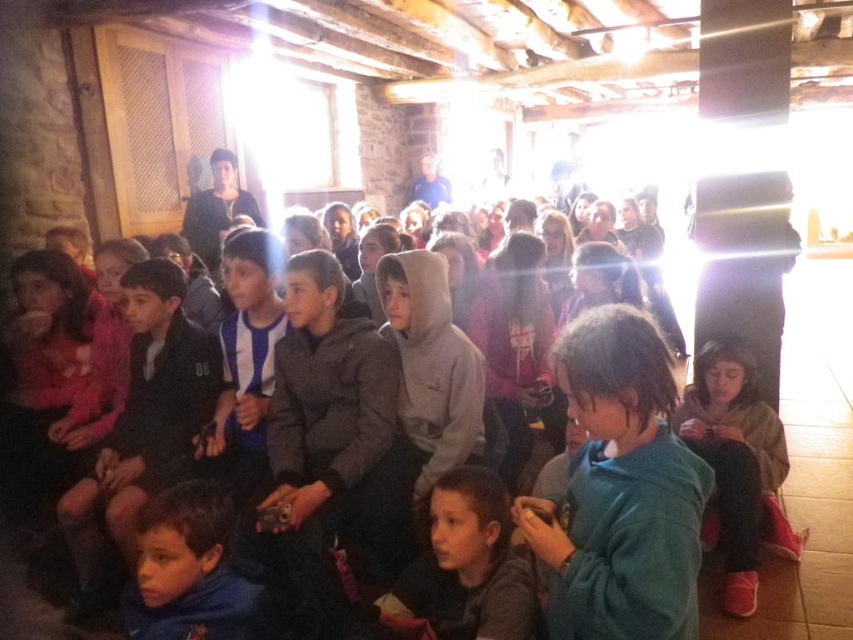
Question: Among these points, which one is farthest from the camera?

Choices:
 (A) (x=491, y=596)
 (B) (x=740, y=614)
 (C) (x=651, y=596)

Answer: (B)

Question: Is green fleece jacket at center closer to camera compared to gray hoodie at center?

Choices:
 (A) no
 (B) yes

Answer: (B)

Question: Does brown fuzzy jacket at lower right lie behind gray hoodie at center?

Choices:
 (A) yes
 (B) no

Answer: (A)

Question: Among these objects, which one is farthest from the camera?

Choices:
 (A) gray hoodie at center
 (B) green fleece jacket at center
 (C) brown fuzzy jacket at lower right

Answer: (C)

Question: Which of the following is the farthest from the observer?

Choices:
 (A) (688, 433)
 (B) (693, 580)

Answer: (A)

Question: Can you confirm if green fleece jacket at center is positioned to the left of gray hoodie at center?

Choices:
 (A) no
 (B) yes

Answer: (A)